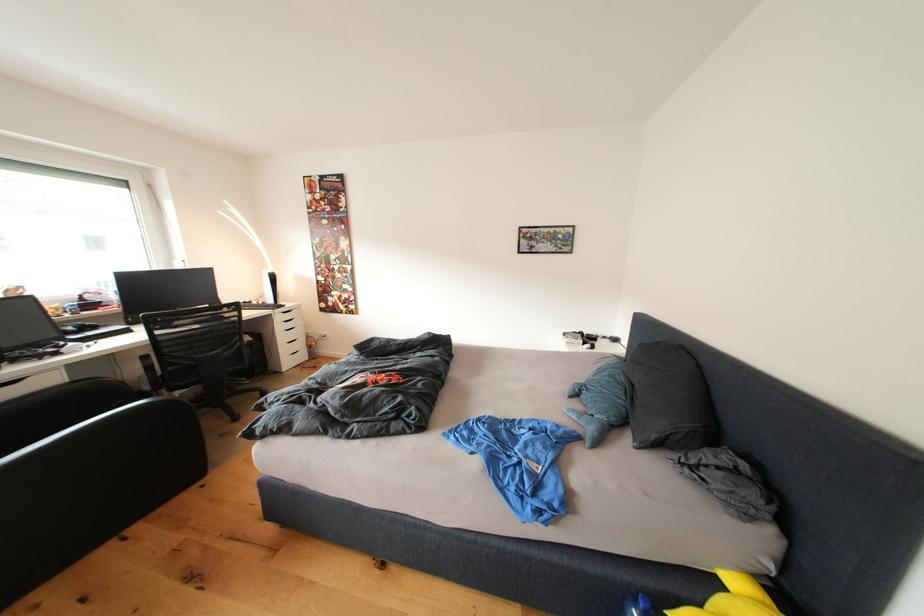
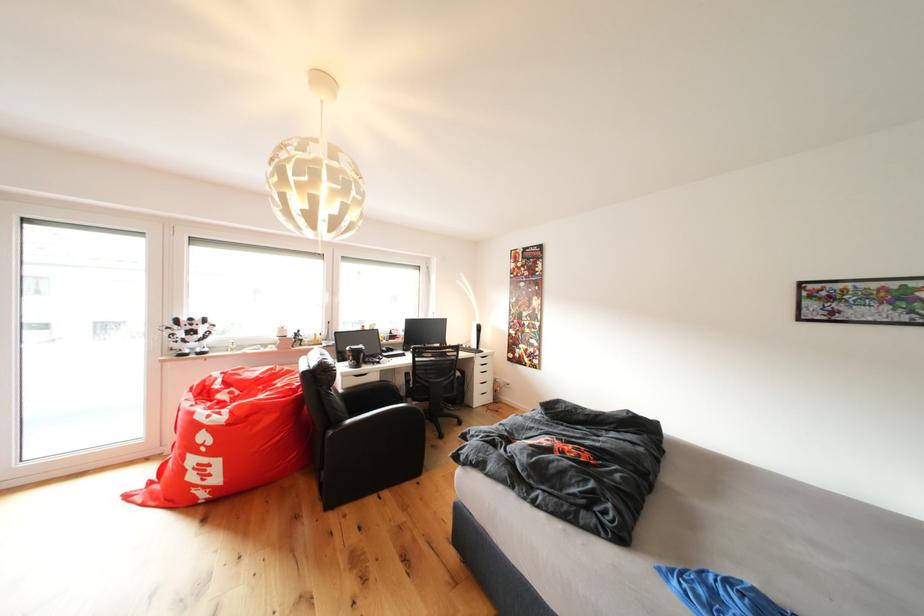
Locate, in the second image, the point that corresponds to point (287, 323) in the first image.

(487, 366)